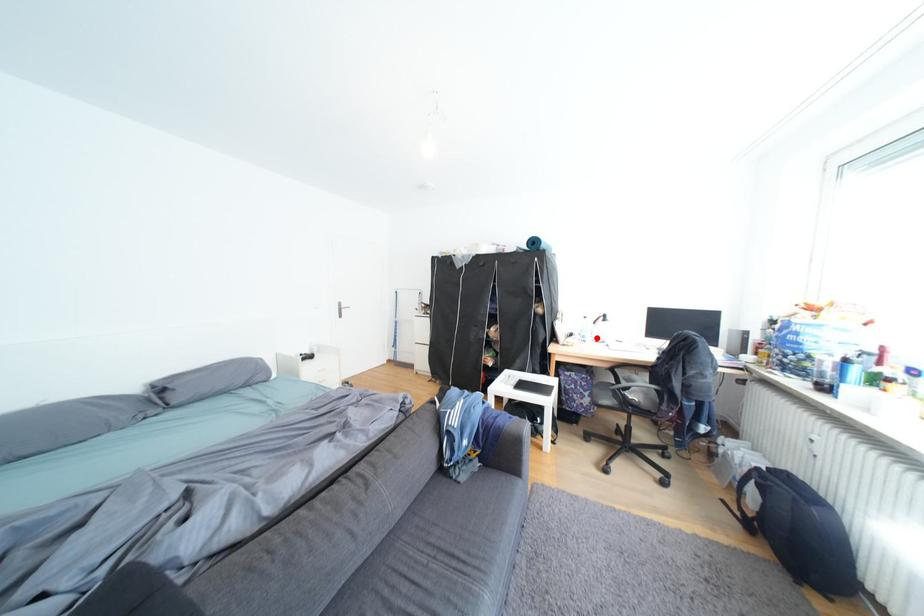
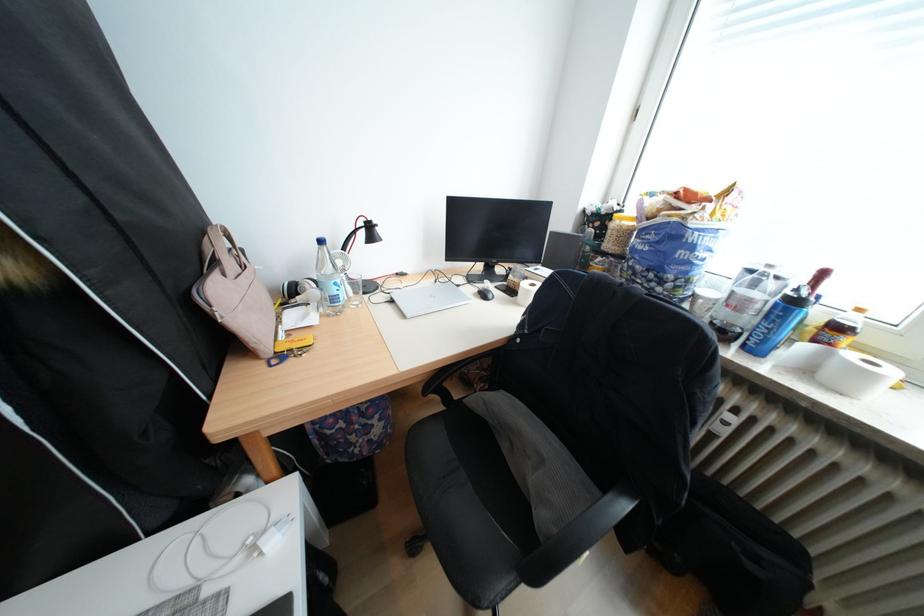
Where in the second image is the point corresponding to the highlighted location from the first image?

(346, 300)